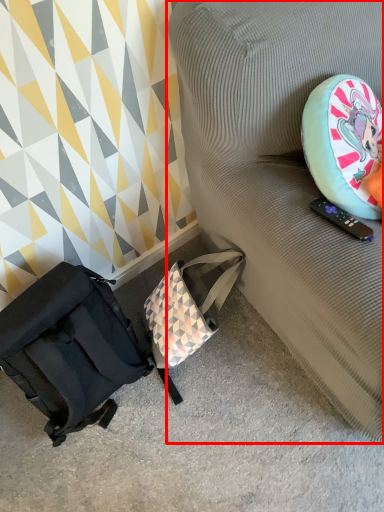
Question: From the image's perspective, what is the correct spatial positioning of furniture (annotated by the red box) in reference to luggage and bags?

Choices:
 (A) below
 (B) above

Answer: (B)